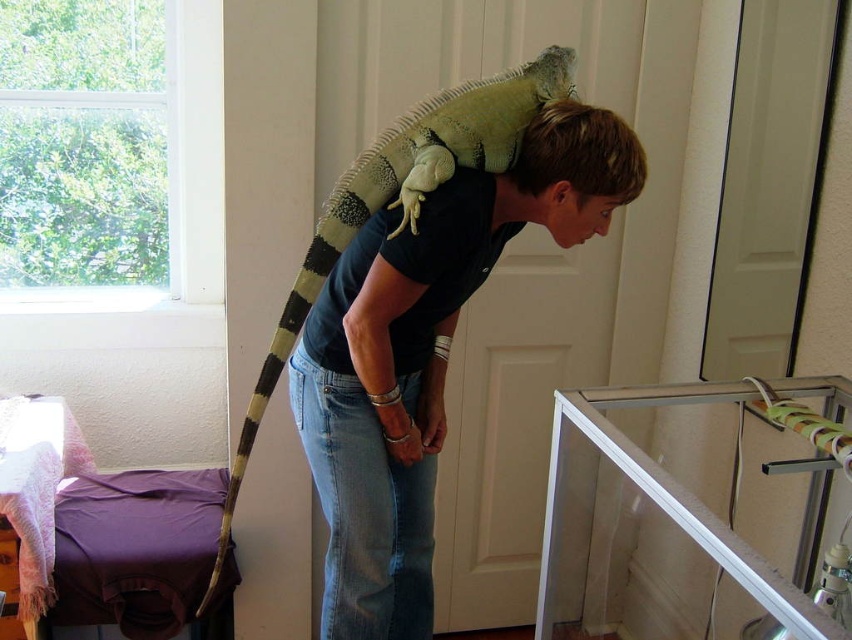
Question: Which of the following is the closest to the observer?

Choices:
 (A) (556, 156)
 (B) (413, 346)

Answer: (A)

Question: Does matte black shirt at upper center have a larger size compared to short blonde hair at upper center?

Choices:
 (A) no
 (B) yes

Answer: (B)

Question: Which point is closer to the camera taking this photo?

Choices:
 (A) 521,192
 (B) 597,180

Answer: (B)

Question: Among these objects, which one is nearest to the camera?

Choices:
 (A) short blonde hair at upper center
 (B) matte black shirt at upper center

Answer: (B)

Question: From the image, what is the correct spatial relationship of matte black shirt at upper center in relation to short blonde hair at upper center?

Choices:
 (A) left
 (B) right

Answer: (A)

Question: Does matte black shirt at upper center lie in front of short blonde hair at upper center?

Choices:
 (A) yes
 (B) no

Answer: (A)